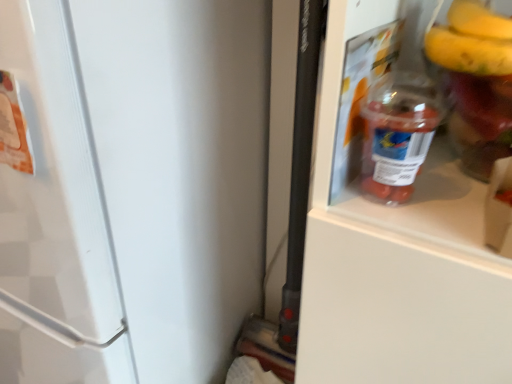
Question: Considering their positions, is white matte refrigerator door at right located in front of or behind translucent plastic bottle at center?

Choices:
 (A) behind
 (B) front

Answer: (B)

Question: Which is correct: white matte refrigerator door at right is inside translucent plastic bottle at center, or outside of it?

Choices:
 (A) outside
 (B) inside

Answer: (A)

Question: Considering the positions of white matte refrigerator door at right and translucent plastic bottle at center in the image, is white matte refrigerator door at right wider or thinner than translucent plastic bottle at center?

Choices:
 (A) wide
 (B) thin

Answer: (A)

Question: From a real-world perspective, is translucent plastic bottle at center physically located above or below white matte refrigerator door at right?

Choices:
 (A) below
 (B) above

Answer: (B)

Question: Is point (365, 157) closer or farther from the camera than point (139, 215)?

Choices:
 (A) farther
 (B) closer

Answer: (B)

Question: In terms of size, does translucent plastic bottle at center appear bigger or smaller than white matte refrigerator door at right?

Choices:
 (A) big
 (B) small

Answer: (B)

Question: Is translucent plastic bottle at center taller or shorter than white matte refrigerator door at right?

Choices:
 (A) tall
 (B) short

Answer: (B)